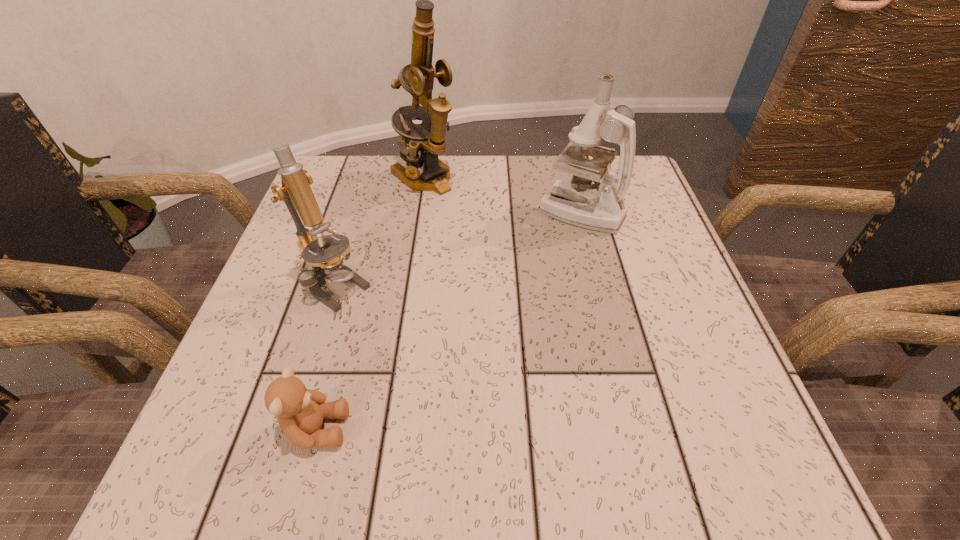
In order to click on microscope that is positioned at the left edge in this screenshot , I will do `click(327, 264)`.

Where is `teddy bear located at the left edge`? This screenshot has width=960, height=540. teddy bear located at the left edge is located at coordinates (300, 411).

What are the coordinates of `object situated at the right edge` in the screenshot? It's located at (576, 203).

Find the location of a particular element. This screenshot has height=540, width=960. object that is positioned at the near left corner is located at coordinates (300, 411).

The height and width of the screenshot is (540, 960). What are the coordinates of `object located in the far right corner section of the desktop` in the screenshot? It's located at (576, 203).

In the image, there is a desktop. Where is `vacant space at the far edge`? This screenshot has height=540, width=960. vacant space at the far edge is located at coordinates (564, 177).

Where is `free space at the near edge`? This screenshot has height=540, width=960. free space at the near edge is located at coordinates (329, 450).

Where is `vacant space at the left edge of the desktop`? This screenshot has width=960, height=540. vacant space at the left edge of the desktop is located at coordinates (268, 355).

Locate an element on the screen. free space at the right edge of the desktop is located at coordinates (637, 217).

Identify the location of vacant space at the far right corner of the desktop. The width and height of the screenshot is (960, 540). (649, 195).